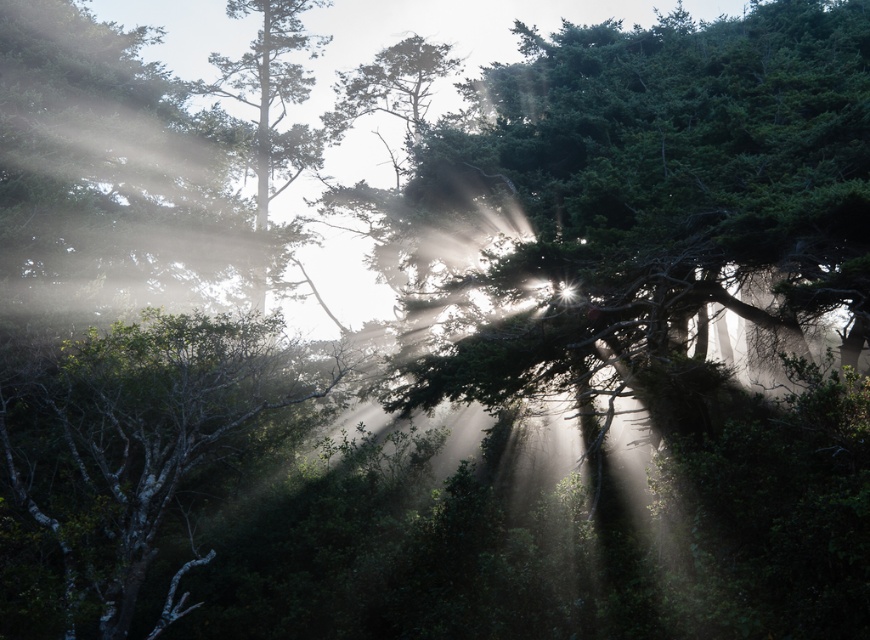
You are standing in the forest and see the green matte tree at upper left and the green matte tree at lower left. Which tree is positioned more to the left side of the forest?

The green matte tree at upper left is positioned more to the left side of the forest than the green matte tree at lower left.

You are a hiker standing at the edge of the forest and see the green matte tree at upper left and the green matte tree at center. Which tree would appear taller from your current position?

The green matte tree at center is taller than the green matte tree at upper left, so it would appear taller from your current position.

You are standing in the forest and see the green matte tree at lower left. If you walk straight ahead, will you eventually reach the point marked at coordinate point (135, 438)?

Yes, because the green matte tree at lower left is located exactly at point (135, 438), so walking straight towards it would lead you to that coordinate.